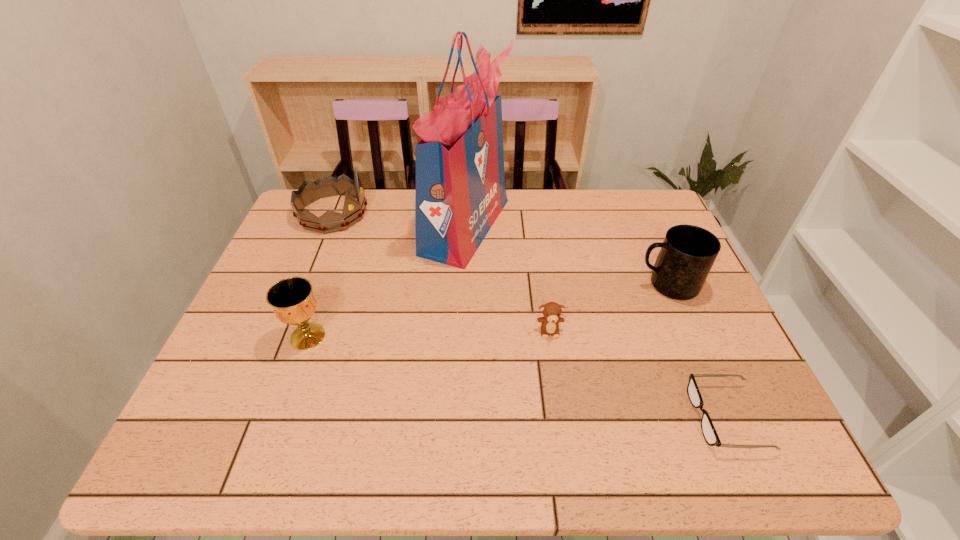
The image size is (960, 540). In order to click on vacant area at the left edge of the desktop in this screenshot , I will do tap(216, 382).

This screenshot has width=960, height=540. I want to click on blank space at the right edge of the desktop, so click(679, 373).

Identify the location of free space at the near left corner of the desktop. This screenshot has width=960, height=540. 252,464.

Identify the location of free space at the far right corner of the desktop. (614, 213).

Locate an element on the screen. The image size is (960, 540). vacant space in between the chalice and the fourth object from left to right is located at coordinates (428, 333).

Identify the location of unoccupied position between the third object from left to right and the nearest object. This screenshot has width=960, height=540. (596, 321).

The image size is (960, 540). Identify the location of free area in between the shortest object and the tallest object. (596, 321).

At what (x,y) coordinates should I click in order to perform the action: click on free space between the tiara and the teddy bear. Please return your answer as a coordinate pair (x, y). Looking at the image, I should click on (441, 272).

You are a GUI agent. You are given a task and a screenshot of the screen. Output one action in this format:
    pyautogui.click(x=<x>, y=<y>)
    Task: Click on the vacant space that is in between the shortest object and the tallest object
    The width and height of the screenshot is (960, 540).
    Given the screenshot: What is the action you would take?
    pyautogui.click(x=596, y=321)

The image size is (960, 540). In order to click on vacant space that is in between the chalice and the grocery bag in this screenshot , I will do `click(387, 281)`.